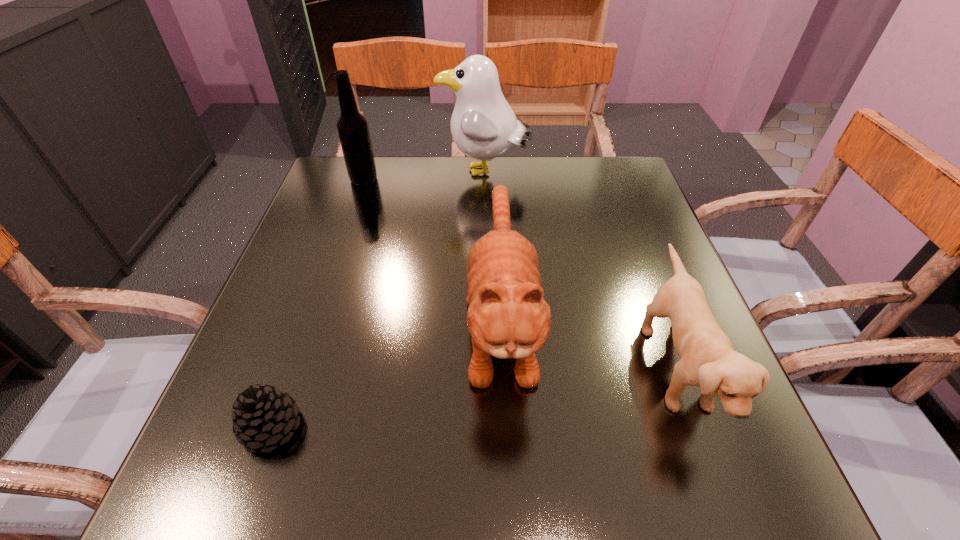
Where is `free space that satisfies the following two spatial constraints: 1. on the face of the cat; 2. at the narrow end of the shortest object`? The height and width of the screenshot is (540, 960). free space that satisfies the following two spatial constraints: 1. on the face of the cat; 2. at the narrow end of the shortest object is located at coordinates (506, 427).